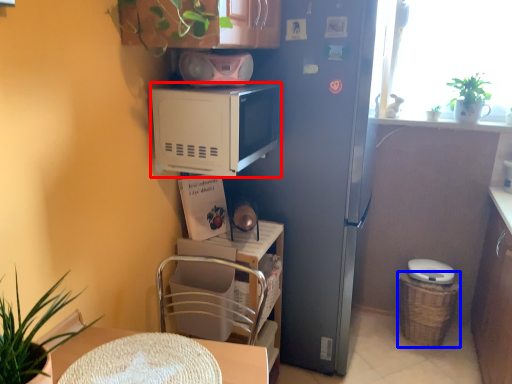
Question: Which point is further to the camera, microwave oven (highlighted by a red box) or basket (highlighted by a blue box)?

Choices:
 (A) microwave oven
 (B) basket

Answer: (B)